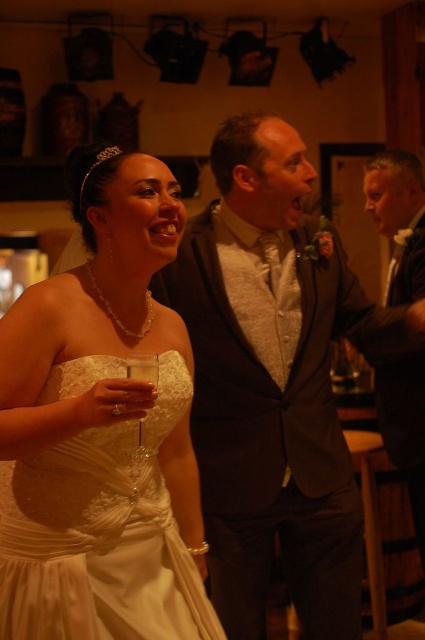
You are a photographer at the wedding reception. You need to capture a closeup shot of the bride in her white satin dress at left and the clear glass wine glass at lower left. Which object is bigger in the photo?

The white satin dress at left is larger in size compared to the clear glass wine glass at lower left, so it will appear bigger in the photo.

You are a photographer at the wedding reception. You want to capture a photo that includes both the white satin dress at left and the shiny silver vest at center. Which object should you position closer to the left side of the frame to ensure both are visible?

To ensure both the white satin dress at left and the shiny silver vest at center are visible in the photo, position the white satin dress at left closer to the left side of the frame since it is already on the left side of the shiny silver vest at center.